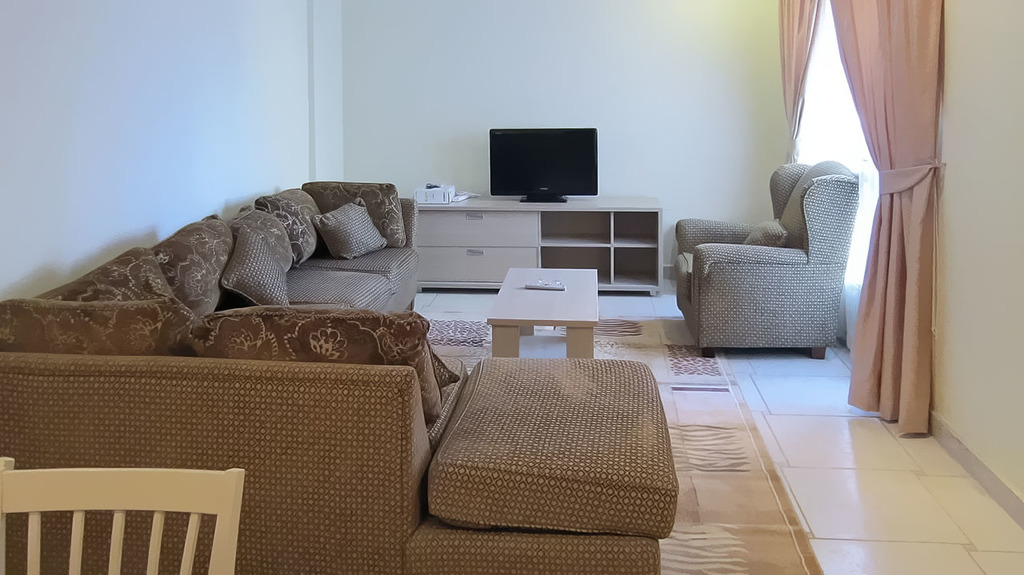
Identify the location of white wall. (171, 154), (437, 85).